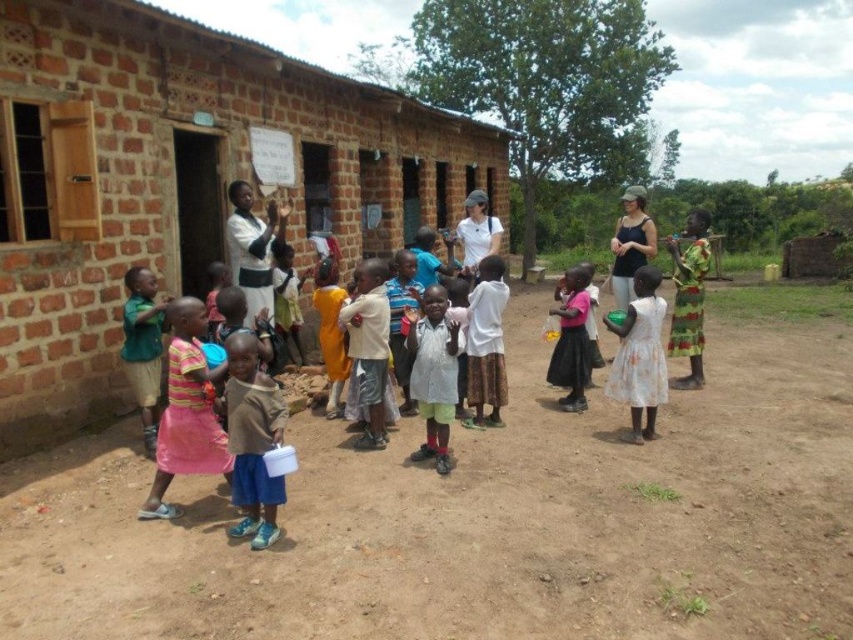
Question: Which object is closer to the camera taking this photo?

Choices:
 (A) brown brick building at center
 (B) brown cotton shirt at lower left
 (C) brown dirt field at center

Answer: (B)

Question: Does brown brick building at center have a lesser width compared to white matte shirt at center?

Choices:
 (A) no
 (B) yes

Answer: (A)

Question: Is brown cotton shirt at lower left closer to camera compared to white floral dress at center?

Choices:
 (A) yes
 (B) no

Answer: (A)

Question: Among these objects, which one is farthest from the camera?

Choices:
 (A) white cotton shirt at center
 (B) pink fabric dress at center
 (C) camouflage-patterned dress at right

Answer: (C)

Question: Which point is farther to the camera?

Choices:
 (A) (93, 122)
 (B) (651, 308)

Answer: (B)

Question: Is brown dirt field at center thinner than brown cotton shirt at lower left?

Choices:
 (A) yes
 (B) no

Answer: (A)